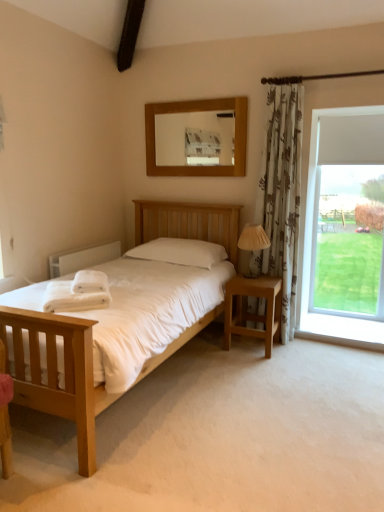
Question: Considering the relative positions of white painted radiator at left and wooden mirror at upper center in the image provided, is white painted radiator at left to the right of wooden mirror at upper center from the viewer's perspective?

Choices:
 (A) no
 (B) yes

Answer: (A)

Question: Is white painted radiator at left turned away from wooden mirror at upper center?

Choices:
 (A) no
 (B) yes

Answer: (A)

Question: Does white painted radiator at left have a lesser height compared to wooden mirror at upper center?

Choices:
 (A) no
 (B) yes

Answer: (B)

Question: Does white painted radiator at left appear on the left side of wooden mirror at upper center?

Choices:
 (A) yes
 (B) no

Answer: (A)

Question: Could you tell me if white painted radiator at left is facing wooden mirror at upper center?

Choices:
 (A) no
 (B) yes

Answer: (A)

Question: Considering the relative sizes of white painted radiator at left and wooden mirror at upper center in the image provided, is white painted radiator at left taller than wooden mirror at upper center?

Choices:
 (A) yes
 (B) no

Answer: (B)

Question: Does brown fabric curtain at upper right have a greater height compared to white soft towels at left?

Choices:
 (A) yes
 (B) no

Answer: (A)

Question: Is the surface of brown fabric curtain at upper right in direct contact with white soft towels at left?

Choices:
 (A) no
 (B) yes

Answer: (A)

Question: Is brown fabric curtain at upper right behind white soft towels at left?

Choices:
 (A) no
 (B) yes

Answer: (B)

Question: Is brown fabric curtain at upper right looking in the opposite direction of white soft towels at left?

Choices:
 (A) yes
 (B) no

Answer: (B)

Question: Is brown fabric curtain at upper right thinner than white soft towels at left?

Choices:
 (A) no
 (B) yes

Answer: (B)

Question: Is brown fabric curtain at upper right oriented towards white soft towels at left?

Choices:
 (A) yes
 (B) no

Answer: (B)

Question: Can we say wooden nightstand at right lies outside white soft towel at lower left?

Choices:
 (A) yes
 (B) no

Answer: (A)